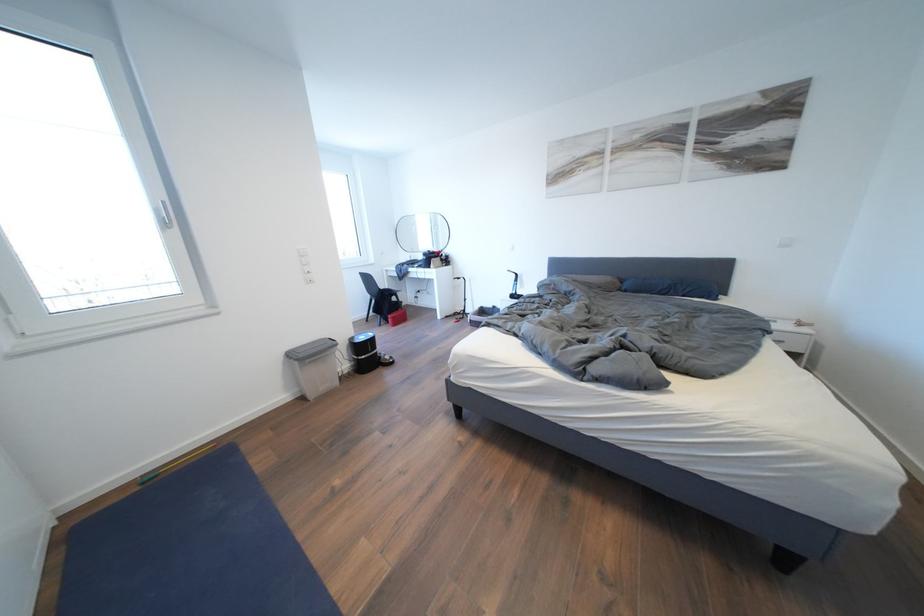
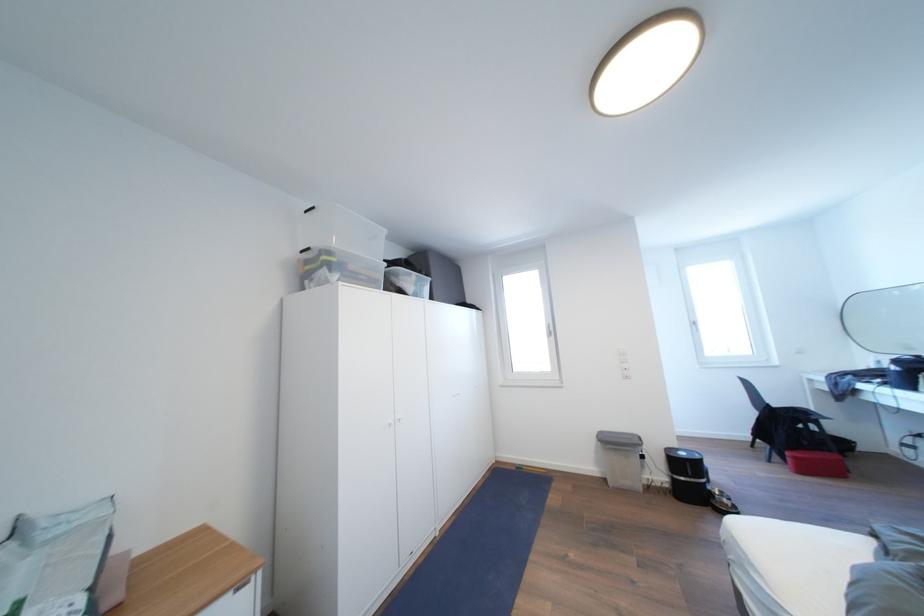
Find the pixel in the second image that matches (144,493) in the first image.

(521, 472)